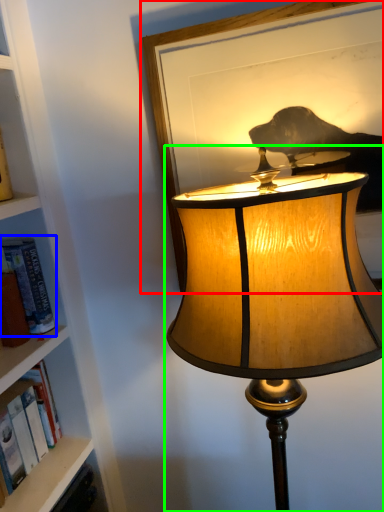
Question: Which object is the farthest from picture frame (highlighted by a red box)? Choose among these: book (highlighted by a blue box) or lamp (highlighted by a green box).

Choices:
 (A) book
 (B) lamp

Answer: (A)